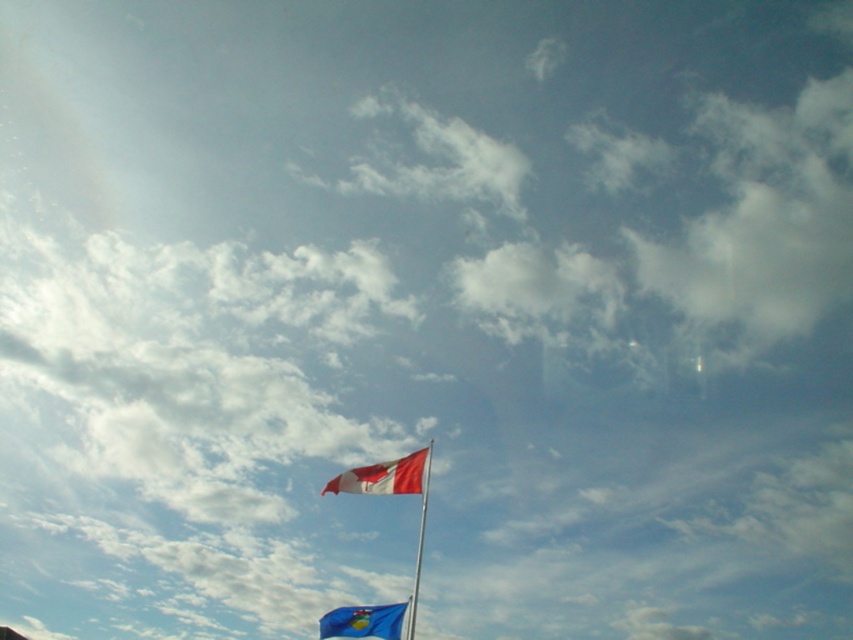
You are standing in front of two flags displayed in the image. The blue fabric flag at lower center and the metallic flag pole at center. Which flag is closer to you?

The blue fabric flag at lower center is closer to you because it is further to the viewer than the metallic flag pole at center.

You are standing in front of two flags displayed in the image. You notice the red fabric flag at center and the metallic flag pole at center. Which flag is closer to your left side?

The red fabric flag at center is positioned on the left side of the metallic flag pole at center, so it is closer to your left side.

You are standing in front of the two flags displayed in the image. Which point, point (357,484) or point (322,628), is closer to you?

Point (357,484) is closer to you because it is further to the viewer than point (322,628).